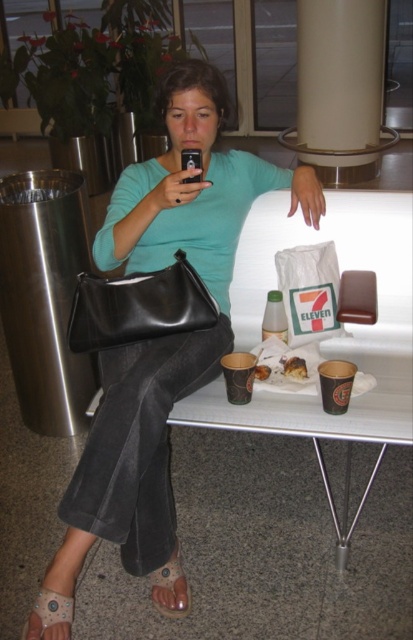
Question: Does black leather bag at center have a smaller size compared to matte brown paper cup at center?

Choices:
 (A) yes
 (B) no

Answer: (B)

Question: Which of these objects is positioned farthest from the matte brown paper cup at center?

Choices:
 (A) golden brown cake at center
 (B) matte black purse at center
 (C) leather sandal at lower left

Answer: (C)

Question: Is black leather bag at center below leather sandal at lower left?

Choices:
 (A) yes
 (B) no

Answer: (B)

Question: Estimate the real-world distances between objects in this image. Which object is farther from the black leather bag at center?

Choices:
 (A) golden brown cake at center
 (B) brown suede sandal at lower left
 (C) matte brown paper cup at center
 (D) matte black purse at center

Answer: (B)

Question: Is matte black purse at center wider than black leather bag at center?

Choices:
 (A) no
 (B) yes

Answer: (B)

Question: Which point appears farthest from the camera in this image?

Choices:
 (A) (299, 378)
 (B) (80, 348)
 (C) (184, 369)
 (D) (42, 589)

Answer: (A)